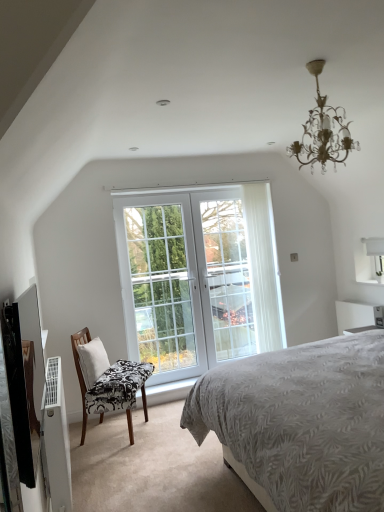
I want to click on vacant area that is in front of black and white patterned fabric chair at lower left, so click(x=110, y=455).